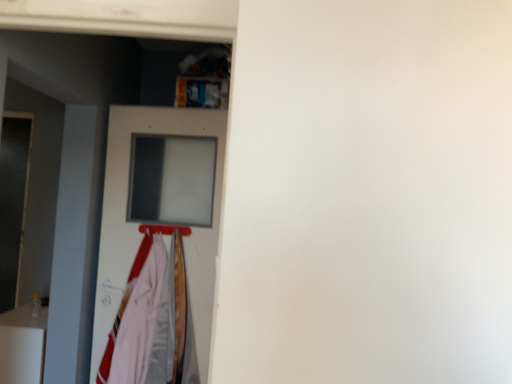
Question: From the image's perspective, is metallic silver hanger at center above or below white matte door at center?

Choices:
 (A) above
 (B) below

Answer: (A)

Question: Is metallic silver hanger at center to the left or to the right of white matte door at center in the image?

Choices:
 (A) left
 (B) right

Answer: (B)

Question: Which object is positioned farthest from the white fabric at left?

Choices:
 (A) white glossy fridge at lower left
 (B) metallic silver hanger at center
 (C) white matte door at center

Answer: (A)

Question: Which object is positioned closest to the white glossy fridge at lower left?

Choices:
 (A) white matte door at center
 (B) metallic silver hanger at center
 (C) white fabric at left

Answer: (C)